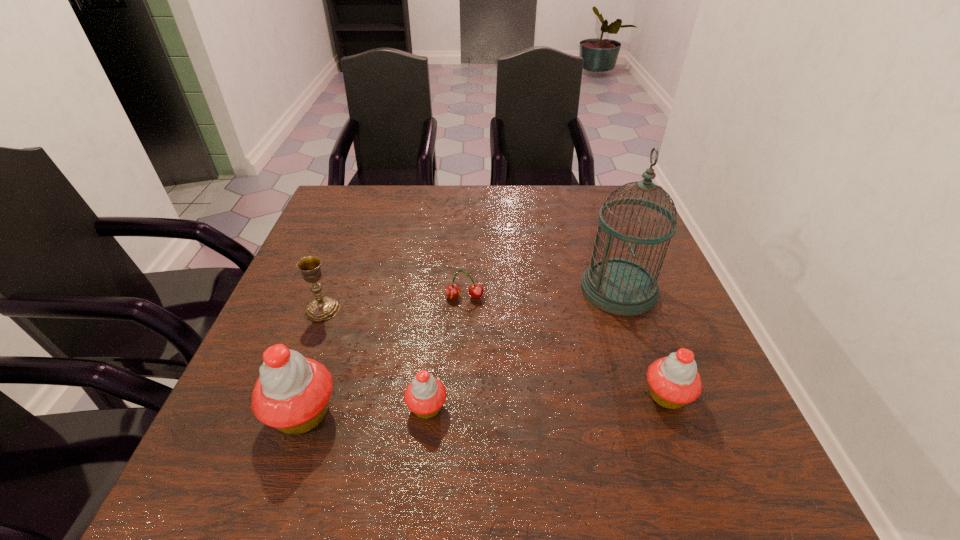
You are a GUI agent. You are given a task and a screenshot of the screen. Output one action in this format:
    pyautogui.click(x=<x>, y=<y>)
    Task: Click on the closest cupcake to the fifth shortest object
    This screenshot has height=540, width=960.
    Given the screenshot: What is the action you would take?
    pyautogui.click(x=425, y=395)

The image size is (960, 540). In order to click on free space that satisfies the following two spatial constraints: 1. on the front-facing side of the birdcage; 2. with stems pointing upwards on the shortest object in this screenshot , I will do `click(621, 297)`.

Image resolution: width=960 pixels, height=540 pixels. What are the coordinates of `vacant space that satisfies the following two spatial constraints: 1. on the front-facing side of the tallest object; 2. on the front side of the chalice` in the screenshot? It's located at (626, 310).

The height and width of the screenshot is (540, 960). In order to click on free space that satisfies the following two spatial constraints: 1. on the front-facing side of the tallest object; 2. with stems pointing upwards on the cherry in this screenshot , I will do `click(621, 297)`.